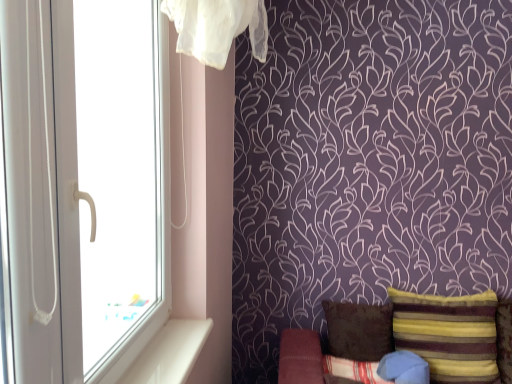
Describe the element at coordinates (359, 330) in the screenshot. The width and height of the screenshot is (512, 384). I see `brown fabric pillow at lower right, which ranks as the 4th pillow in right-to-left order` at that location.

Based on the photo, measure the distance between point [357,336] and camera.

Point [357,336] is 2.30 meters away from camera.

Locate an element on the screen. white plastic window at left is located at coordinates (111, 181).

What do you see at coordinates (111, 181) in the screenshot? I see `white plastic window at left` at bounding box center [111, 181].

Measure the distance between blue cotton pillow at lower right, which appears as the 3th pillow when viewed from the right, and camera.

blue cotton pillow at lower right, which appears as the 3th pillow when viewed from the right, and camera are 2.06 meters apart.

Locate an element on the screen. This screenshot has height=384, width=512. brown fabric pillow at lower right, the 1th pillow in the left-to-right sequence is located at coordinates (359, 330).

Find the location of a particular element. the 1st pillow in front of the striped velvet pillow at lower right, positioned as the 1th pillow in right-to-left order, starting your count from the anchor is located at coordinates (404, 368).

Between blue fabric pillow at lower right, acting as the 2th pillow starting from the right, and striped velvet pillow at lower right, marked as the 4th pillow in a left-to-right arrangement, which one is positioned in front?

blue fabric pillow at lower right, acting as the 2th pillow starting from the right, is more forward.

Which point is more forward, (426, 371) or (436, 347)?

The point (426, 371) is closer to the camera.

From the image's perspective, which object appears higher, blue fabric pillow at lower right, acting as the 2th pillow starting from the right, or striped velvet pillow at lower right, positioned as the 1th pillow in right-to-left order?

striped velvet pillow at lower right, positioned as the 1th pillow in right-to-left order, appears higher in the image.

Is striped velvet pillow at lower right, positioned as the 1th pillow in right-to-left order, surrounded by brown fabric pillow at lower right, which ranks as the 4th pillow in right-to-left order?

No, striped velvet pillow at lower right, positioned as the 1th pillow in right-to-left order, is not a part of brown fabric pillow at lower right, which ranks as the 4th pillow in right-to-left order.

In the scene shown: Which is behind, brown fabric pillow at lower right, the 1th pillow in the left-to-right sequence, or striped velvet pillow at lower right, marked as the 4th pillow in a left-to-right arrangement?

brown fabric pillow at lower right, the 1th pillow in the left-to-right sequence, is more distant.

Is there a large distance between brown fabric pillow at lower right, the 1th pillow in the left-to-right sequence, and striped velvet pillow at lower right, marked as the 4th pillow in a left-to-right arrangement?

No.

Looking at this image, who is taller, brown fabric pillow at lower right, which ranks as the 4th pillow in right-to-left order, or striped velvet pillow at lower right, positioned as the 1th pillow in right-to-left order?

striped velvet pillow at lower right, positioned as the 1th pillow in right-to-left order.

Does striped velvet pillow at lower right, positioned as the 1th pillow in right-to-left order, turn towards white smooth window sill at lower left?

No, striped velvet pillow at lower right, positioned as the 1th pillow in right-to-left order, is not turned towards white smooth window sill at lower left.

Where is `window sill above the striped velvet pillow at lower right, marked as the 4th pillow in a left-to-right arrangement (from a real-world perspective)`? The height and width of the screenshot is (384, 512). window sill above the striped velvet pillow at lower right, marked as the 4th pillow in a left-to-right arrangement (from a real-world perspective) is located at coordinates (170, 353).

Can you tell me how much striped velvet pillow at lower right, marked as the 4th pillow in a left-to-right arrangement, and white smooth window sill at lower left differ in facing direction?

90.1 degrees separate the facing orientations of striped velvet pillow at lower right, marked as the 4th pillow in a left-to-right arrangement, and white smooth window sill at lower left.

Considering the sizes of objects striped velvet pillow at lower right, marked as the 4th pillow in a left-to-right arrangement, and white smooth window sill at lower left in the image provided, who is shorter, striped velvet pillow at lower right, marked as the 4th pillow in a left-to-right arrangement, or white smooth window sill at lower left?

Standing shorter between the two is white smooth window sill at lower left.

Is blue fabric pillow at lower right, acting as the 2th pillow starting from the right, surrounding white smooth window sill at lower left?

No, white smooth window sill at lower left is located outside of blue fabric pillow at lower right, acting as the 2th pillow starting from the right.

Considering their positions, is blue fabric pillow at lower right, acting as the 2th pillow starting from the right, located in front of or behind white smooth window sill at lower left?

In the image, blue fabric pillow at lower right, acting as the 2th pillow starting from the right, appears behind white smooth window sill at lower left.

Which object is positioned more to the left, blue fabric pillow at lower right, acting as the 2th pillow starting from the right, or white smooth window sill at lower left?

white smooth window sill at lower left is more to the left.

Which of these two, blue fabric pillow at lower right, the 3th pillow in the left-to-right sequence, or white smooth window sill at lower left, is thinner?

white smooth window sill at lower left is thinner.

Considering the positions of point (357, 370) and point (385, 355), is point (357, 370) closer or farther from the camera than point (385, 355)?

Point (357, 370) is positioned closer to the camera compared to point (385, 355).

Are blue cotton pillow at lower right, which is the second pillow in left-to-right order, and blue fabric pillow at lower right, the 3th pillow in the left-to-right sequence, far apart?

blue cotton pillow at lower right, which is the second pillow in left-to-right order, is near blue fabric pillow at lower right, the 3th pillow in the left-to-right sequence, not far away.

From the picture: Which is more to the left, blue cotton pillow at lower right, which appears as the 3th pillow when viewed from the right, or blue fabric pillow at lower right, acting as the 2th pillow starting from the right?

From the viewer's perspective, blue cotton pillow at lower right, which appears as the 3th pillow when viewed from the right, appears more on the left side.

Measure the distance from blue cotton pillow at lower right, which is the second pillow in left-to-right order, to blue fabric pillow at lower right, the 3th pillow in the left-to-right sequence.

blue cotton pillow at lower right, which is the second pillow in left-to-right order, and blue fabric pillow at lower right, the 3th pillow in the left-to-right sequence, are 5.01 inches apart from each other.

Is striped velvet pillow at lower right, marked as the 4th pillow in a left-to-right arrangement, thinner than white plastic window at left?

Incorrect, the width of striped velvet pillow at lower right, marked as the 4th pillow in a left-to-right arrangement, is not less than that of white plastic window at left.

Identify the location of pillow that is the 1st one below the white plastic window at left (from a real-world perspective). The image size is (512, 384). (449, 334).

Can you confirm if striped velvet pillow at lower right, positioned as the 1th pillow in right-to-left order, is shorter than white plastic window at left?

Yes, striped velvet pillow at lower right, positioned as the 1th pillow in right-to-left order, is shorter than white plastic window at left.

From a real-world perspective, relative to white plastic window at left, is striped velvet pillow at lower right, marked as the 4th pillow in a left-to-right arrangement, vertically above or below?

From a real-world perspective, striped velvet pillow at lower right, marked as the 4th pillow in a left-to-right arrangement, is physically below white plastic window at left.

From the image's perspective, is white plastic window at left located beneath blue cotton pillow at lower right, which appears as the 3th pillow when viewed from the right?

Incorrect, from the image's perspective, white plastic window at left is higher than blue cotton pillow at lower right, which appears as the 3th pillow when viewed from the right.

Between white plastic window at left and blue cotton pillow at lower right, which is the second pillow in left-to-right order, which one has more height?

white plastic window at left is taller.

Can you confirm if white plastic window at left is thinner than blue cotton pillow at lower right, which is the second pillow in left-to-right order?

Yes.

The height and width of the screenshot is (384, 512). Find the location of `the 2nd pillow counting from the right side of the white plastic window at left`. the 2nd pillow counting from the right side of the white plastic window at left is located at coordinates (353, 369).

There is a striped velvet pillow at lower right, positioned as the 1th pillow in right-to-left order. Identify the location of the 2nd pillow below it (from a real-world perspective). The image size is (512, 384). (404, 368).

Locate an element on the screen. the 1st pillow positioned below the striped velvet pillow at lower right, marked as the 4th pillow in a left-to-right arrangement (from the image's perspective) is located at coordinates (359, 330).

Looking at the image, which one is located closer to blue fabric pillow at lower right, the 3th pillow in the left-to-right sequence, white smooth window sill at lower left or brown fabric pillow at lower right, which ranks as the 4th pillow in right-to-left order?

brown fabric pillow at lower right, which ranks as the 4th pillow in right-to-left order, is positioned closer to the anchor blue fabric pillow at lower right, the 3th pillow in the left-to-right sequence.

Estimate the real-world distances between objects in this image. Which object is further from striped velvet pillow at lower right, positioned as the 1th pillow in right-to-left order, white plastic window at left or blue fabric pillow at lower right, the 3th pillow in the left-to-right sequence?

white plastic window at left is further to striped velvet pillow at lower right, positioned as the 1th pillow in right-to-left order.

Which object lies nearer to the anchor point striped velvet pillow at lower right, positioned as the 1th pillow in right-to-left order, blue cotton pillow at lower right, which appears as the 3th pillow when viewed from the right, or white smooth window sill at lower left?

blue cotton pillow at lower right, which appears as the 3th pillow when viewed from the right.

Estimate the real-world distances between objects in this image. Which object is closer to white smooth window sill at lower left, blue fabric pillow at lower right, acting as the 2th pillow starting from the right, or striped velvet pillow at lower right, positioned as the 1th pillow in right-to-left order?

The object closer to white smooth window sill at lower left is blue fabric pillow at lower right, acting as the 2th pillow starting from the right.

Looking at this image, looking at the image, which one is located further to striped velvet pillow at lower right, marked as the 4th pillow in a left-to-right arrangement, blue fabric pillow at lower right, the 3th pillow in the left-to-right sequence, or white smooth window sill at lower left?

The object further to striped velvet pillow at lower right, marked as the 4th pillow in a left-to-right arrangement, is white smooth window sill at lower left.

Which object lies further to the anchor point white smooth window sill at lower left, blue fabric pillow at lower right, the 3th pillow in the left-to-right sequence, or brown fabric pillow at lower right, which ranks as the 4th pillow in right-to-left order?

The object further to white smooth window sill at lower left is blue fabric pillow at lower right, the 3th pillow in the left-to-right sequence.

From the image, which object appears to be nearer to blue cotton pillow at lower right, which is the second pillow in left-to-right order, blue fabric pillow at lower right, acting as the 2th pillow starting from the right, or white smooth window sill at lower left?

blue fabric pillow at lower right, acting as the 2th pillow starting from the right.

When comparing their distances from white smooth window sill at lower left, does striped velvet pillow at lower right, positioned as the 1th pillow in right-to-left order, or white plastic window at left seem further?

Among the two, striped velvet pillow at lower right, positioned as the 1th pillow in right-to-left order, is located further to white smooth window sill at lower left.

The height and width of the screenshot is (384, 512). I want to click on pillow between white smooth window sill at lower left and blue cotton pillow at lower right, which appears as the 3th pillow when viewed from the right, from left to right, so click(359, 330).

Image resolution: width=512 pixels, height=384 pixels. I want to click on window sill located between white plastic window at left and blue fabric pillow at lower right, acting as the 2th pillow starting from the right, in the left-right direction, so pos(170,353).

This screenshot has width=512, height=384. I want to click on window sill between white plastic window at left and brown fabric pillow at lower right, which ranks as the 4th pillow in right-to-left order, in the front-back direction, so click(170, 353).

The height and width of the screenshot is (384, 512). In order to click on window sill positioned between white plastic window at left and blue cotton pillow at lower right, which appears as the 3th pillow when viewed from the right, from near to far in this screenshot , I will do `click(170, 353)`.